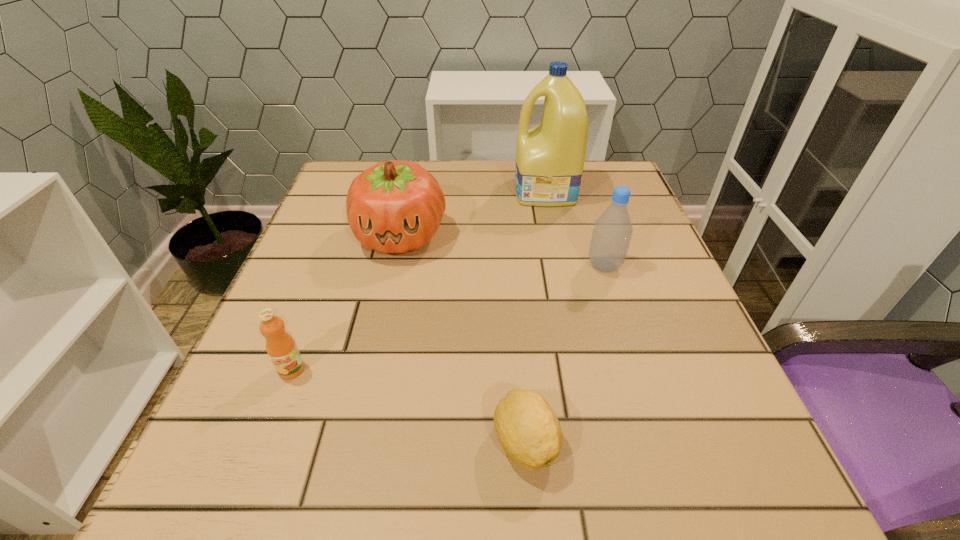
I want to click on bottle located in the right edge section of the desktop, so click(612, 232).

Locate an element on the screen. object located in the far left corner section of the desktop is located at coordinates (396, 206).

Image resolution: width=960 pixels, height=540 pixels. Identify the location of object situated at the far right corner. (550, 157).

This screenshot has width=960, height=540. I want to click on vacant region at the far edge of the desktop, so pos(451,206).

You are a GUI agent. You are given a task and a screenshot of the screen. Output one action in this format:
    pyautogui.click(x=<x>, y=<y>)
    Task: Click on the free region at the near edge of the desktop
    This screenshot has width=960, height=540.
    Given the screenshot: What is the action you would take?
    pyautogui.click(x=558, y=516)

Find the location of a particular element. The width and height of the screenshot is (960, 540). free spot at the left edge of the desktop is located at coordinates (330, 292).

In the image, there is a desktop. Identify the location of free space at the right edge. The width and height of the screenshot is (960, 540). (704, 352).

In the image, there is a desktop. Where is `vacant space at the far left corner`? This screenshot has height=540, width=960. vacant space at the far left corner is located at coordinates (327, 206).

Identify the location of vacant area at the near right corner. (779, 512).

What are the coordinates of `free spot between the bottle and the fourth object from right to left` in the screenshot? It's located at (502, 251).